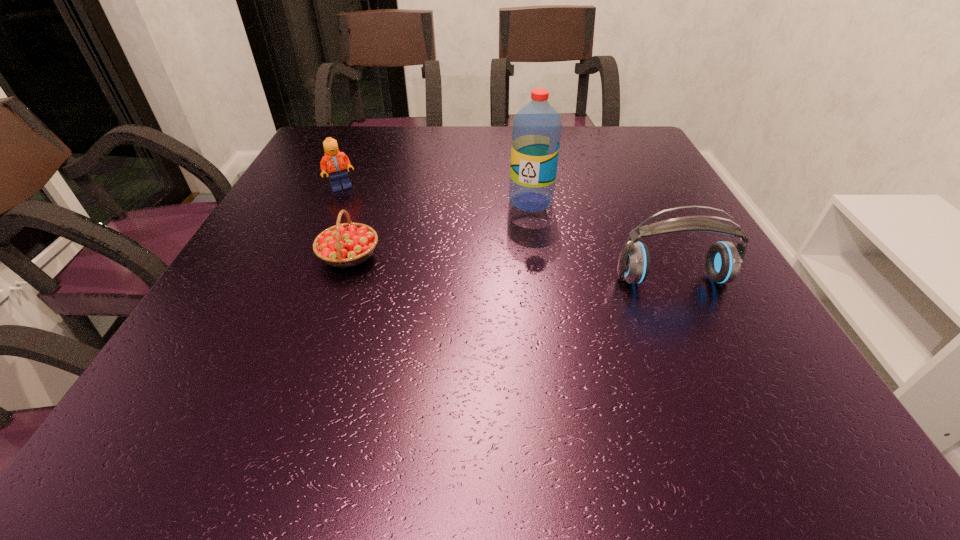
The width and height of the screenshot is (960, 540). Identify the location of vacant space located on the front label of the third object from left to right. pos(459,282).

Identify the location of free space located on the front-facing side of the Lego. The height and width of the screenshot is (540, 960). (428, 238).

You are a GUI agent. You are given a task and a screenshot of the screen. Output one action in this format:
    pyautogui.click(x=<x>, y=<y>)
    Task: Click on the vacant space located on the front-facing side of the Lego
    This screenshot has width=960, height=540.
    Given the screenshot: What is the action you would take?
    pyautogui.click(x=363, y=198)

You are a GUI agent. You are given a task and a screenshot of the screen. Output one action in this format:
    pyautogui.click(x=<x>, y=<y>)
    Task: Click on the vacant space located on the front-facing side of the Lego
    Image resolution: width=960 pixels, height=540 pixels.
    Given the screenshot: What is the action you would take?
    (x=401, y=221)

Identify the location of strawberry located in the left edge section of the desktop. The height and width of the screenshot is (540, 960). (349, 244).

Find the location of a particular element. This screenshot has width=960, height=540. Lego that is at the left edge is located at coordinates (336, 163).

You are a GUI agent. You are given a task and a screenshot of the screen. Output one action in this format:
    pyautogui.click(x=<x>, y=<y>)
    Task: Click on the object located in the right edge section of the desktop
    
    Given the screenshot: What is the action you would take?
    pyautogui.click(x=723, y=261)

This screenshot has height=540, width=960. In order to click on free space at the far edge of the desktop in this screenshot , I will do click(x=490, y=158).

Image resolution: width=960 pixels, height=540 pixels. Identify the location of free region at the near edge of the desktop. (372, 362).

The width and height of the screenshot is (960, 540). In order to click on free space at the left edge in this screenshot , I will do `click(283, 254)`.